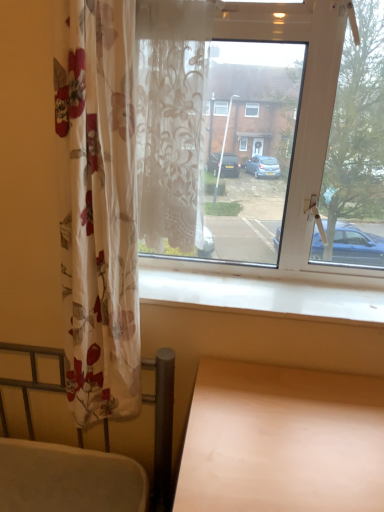
The width and height of the screenshot is (384, 512). I want to click on free space above white smooth window sill at lower center (from a real-world perspective), so click(253, 290).